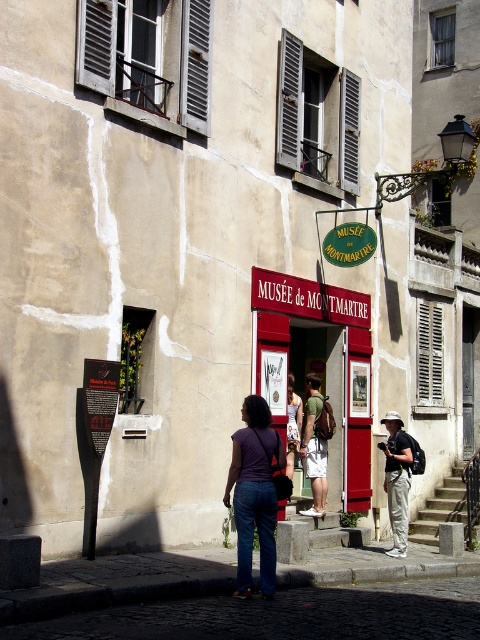
Question: Among these objects, which one is farthest from the camera?

Choices:
 (A) green fabric shorts at center
 (B) khaki cotton pants at center
 (C) purple cotton shirt at center

Answer: (A)

Question: Is khaki cotton pants at center thinner than green fabric shorts at center?

Choices:
 (A) yes
 (B) no

Answer: (A)

Question: Is khaki cotton pants at center to the right of green fabric shorts at center from the viewer's perspective?

Choices:
 (A) yes
 (B) no

Answer: (A)

Question: Is purple cotton shirt at center positioned at the back of denim pants at center?

Choices:
 (A) no
 (B) yes

Answer: (A)

Question: Which of the following is the closest to the observer?

Choices:
 (A) denim pants at center
 (B) purple cotton shirt at center
 (C) khaki cotton pants at center

Answer: (B)

Question: Which object is positioned farthest from the purple cotton shirt at center?

Choices:
 (A) denim pants at center
 (B) green fabric shorts at center
 (C) khaki cotton pants at center

Answer: (B)